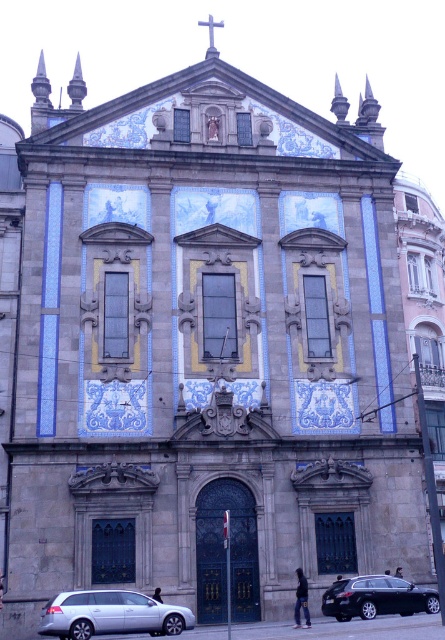
Question: Is silver metallic car at lower left above shiny black sedan at lower center?

Choices:
 (A) no
 (B) yes

Answer: (B)

Question: Which point is farther from the camera taking this photo?

Choices:
 (A) (432, 602)
 (B) (106, 620)

Answer: (A)

Question: Does silver metallic car at lower left lie behind shiny black sedan at lower center?

Choices:
 (A) no
 (B) yes

Answer: (A)

Question: Which point is closer to the camera?

Choices:
 (A) silver metallic car at lower left
 (B) shiny black sedan at lower center

Answer: (A)

Question: Does silver metallic car at lower left have a lesser width compared to shiny black sedan at lower center?

Choices:
 (A) no
 (B) yes

Answer: (B)